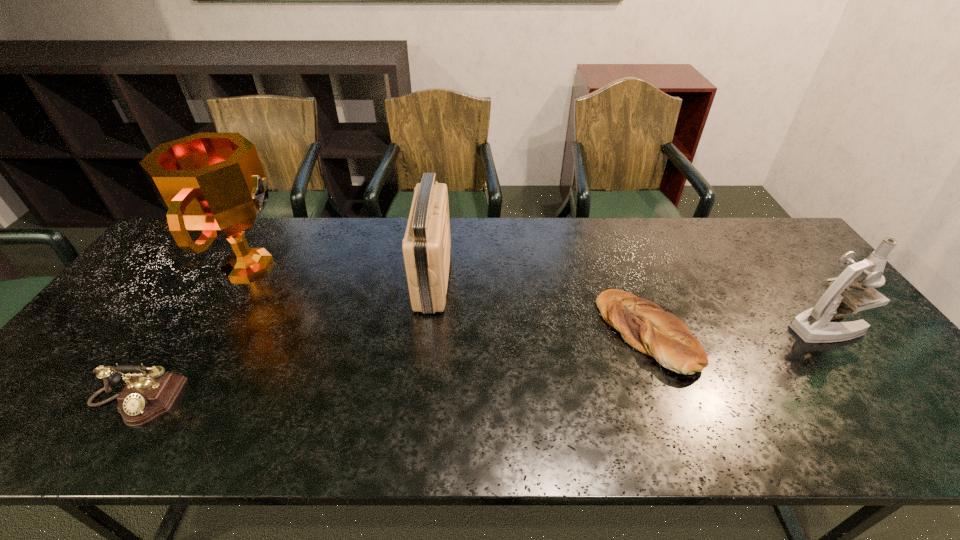
At what (x,y) coordinates should I click in order to perform the action: click on award that is at the far edge. Please return your answer as a coordinate pair (x, y). Looking at the image, I should click on (213, 185).

You are a GUI agent. You are given a task and a screenshot of the screen. Output one action in this format:
    pyautogui.click(x=<x>, y=<y>)
    Task: Click on the radio receiver that is at the far edge
    The height and width of the screenshot is (540, 960).
    Given the screenshot: What is the action you would take?
    pyautogui.click(x=426, y=246)

Locate an element on the screen. object located at the near edge is located at coordinates (145, 396).

I want to click on object present at the left edge, so click(145, 396).

Find the location of a particular element. Image resolution: width=960 pixels, height=540 pixels. object present at the right edge is located at coordinates (813, 325).

Where is `object that is at the near left corner`? This screenshot has width=960, height=540. object that is at the near left corner is located at coordinates (145, 396).

Locate an element on the screen. free region at the far edge of the desktop is located at coordinates (355, 252).

The image size is (960, 540). Identify the location of free spot at the near edge of the desktop. (184, 420).

Locate an element on the screen. The image size is (960, 540). vacant space at the far left corner is located at coordinates click(219, 240).

Find the location of a particular element. Image resolution: width=960 pixels, height=540 pixels. empty location between the second object from right to left and the telephone is located at coordinates (391, 367).